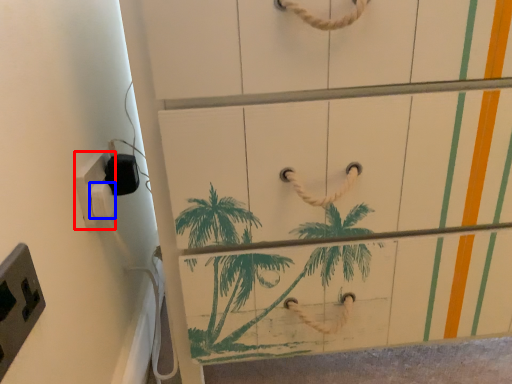
Question: Which object is closer to the camera taking this photo, light switch (highlighted by a red box) or light switch (highlighted by a blue box)?

Choices:
 (A) light switch
 (B) light switch

Answer: (A)